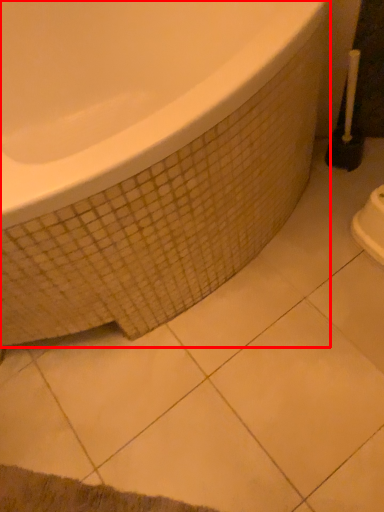
Question: From the image's perspective, considering the relative positions of bathtub (annotated by the red box) and brush in the image provided, where is bathtub (annotated by the red box) located with respect to the staircase?

Choices:
 (A) below
 (B) above

Answer: (A)